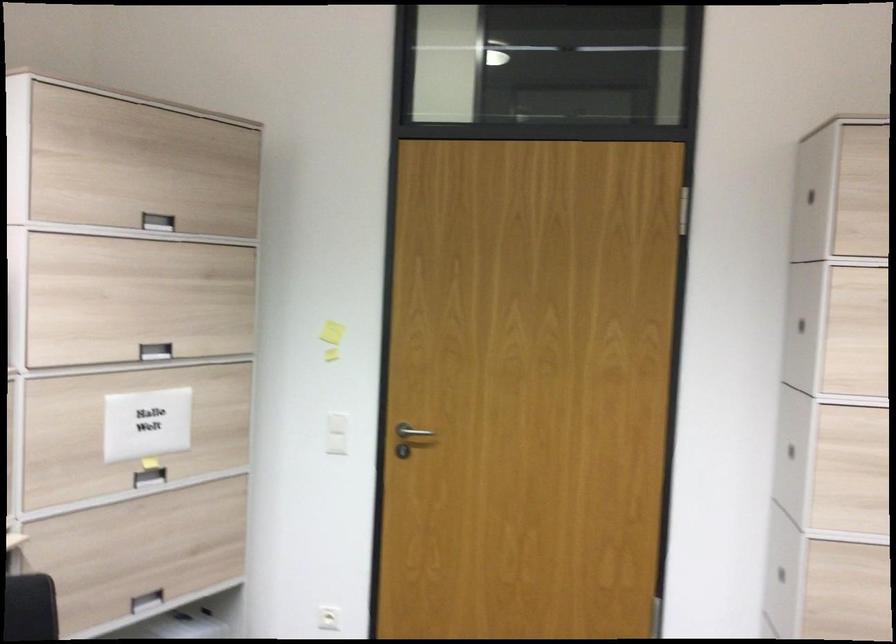
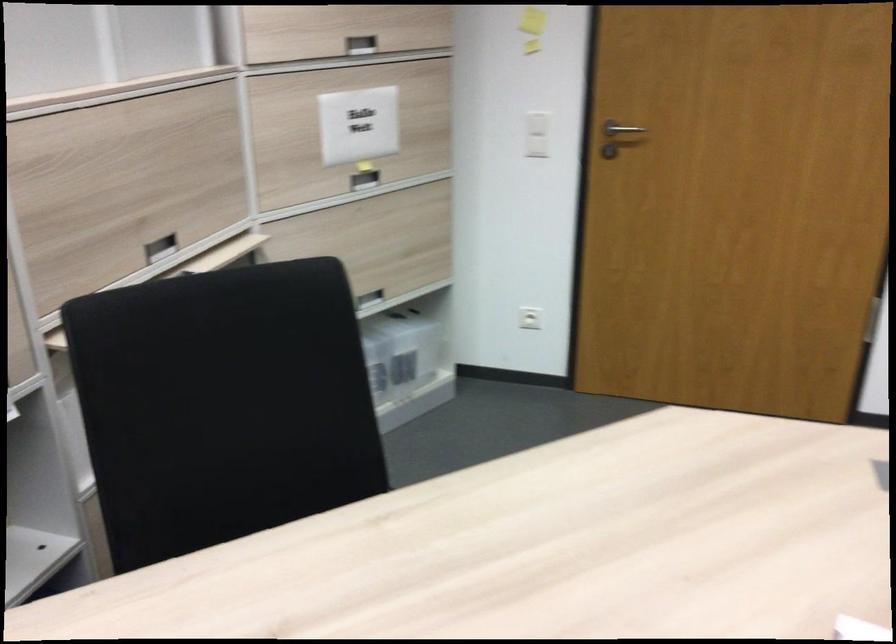
Find the pixel in the second image that matches the point at 157,348 in the first image.

(360, 44)